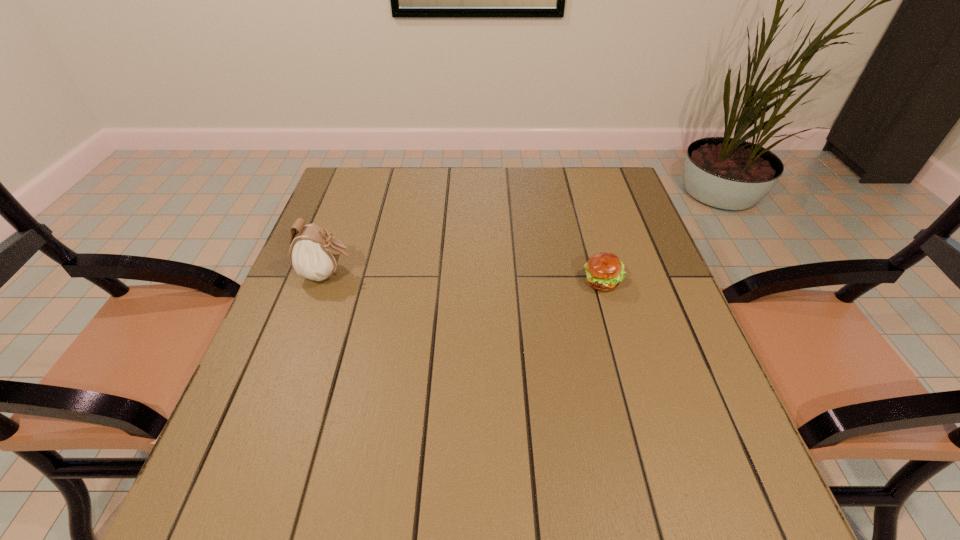
At what (x,y) coordinates should I click in order to perform the action: click on free location at the far left corner of the desktop. Please return your answer as a coordinate pair (x, y). Looking at the image, I should click on (370, 171).

In the image, there is a desktop. Where is `vacant space at the far right corner`? The height and width of the screenshot is (540, 960). vacant space at the far right corner is located at coordinates (616, 206).

Find the location of `free location at the near right corner of the desktop`. free location at the near right corner of the desktop is located at coordinates (731, 477).

Where is `free region that satisfies the following two spatial constraints: 1. on the front-facing side of the shorter object; 2. on the right side of the pouch`? Image resolution: width=960 pixels, height=540 pixels. free region that satisfies the following two spatial constraints: 1. on the front-facing side of the shorter object; 2. on the right side of the pouch is located at coordinates (324, 282).

What are the coordinates of `blank space that satisfies the following two spatial constraints: 1. on the front-facing side of the shorter object; 2. on the left side of the pouch` in the screenshot? It's located at (324, 282).

What are the coordinates of `vacant area in the image that satisfies the following two spatial constraints: 1. on the front-facing side of the pouch; 2. on the left side of the shorter object` in the screenshot? It's located at (324, 282).

The width and height of the screenshot is (960, 540). What are the coordinates of `free point that satisfies the following two spatial constraints: 1. on the front-facing side of the left object; 2. on the right side of the hamburger` in the screenshot? It's located at (324, 282).

This screenshot has height=540, width=960. Identify the location of free point that satisfies the following two spatial constraints: 1. on the front-facing side of the taller object; 2. on the left side of the right object. (324, 282).

The image size is (960, 540). Identify the location of vacant region that satisfies the following two spatial constraints: 1. on the front-facing side of the right object; 2. on the left side of the taller object. (324, 282).

In order to click on free spot that satisfies the following two spatial constraints: 1. on the front-facing side of the taller object; 2. on the right side of the shorter object in this screenshot , I will do `click(324, 282)`.